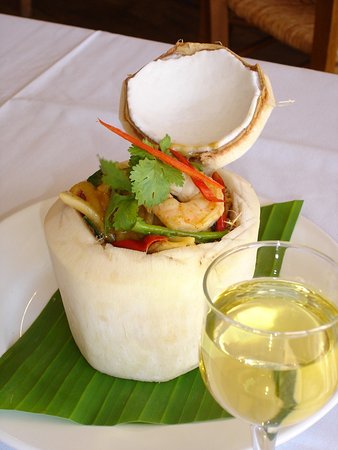
Identify the location of plate. The height and width of the screenshot is (450, 338). (29, 287).